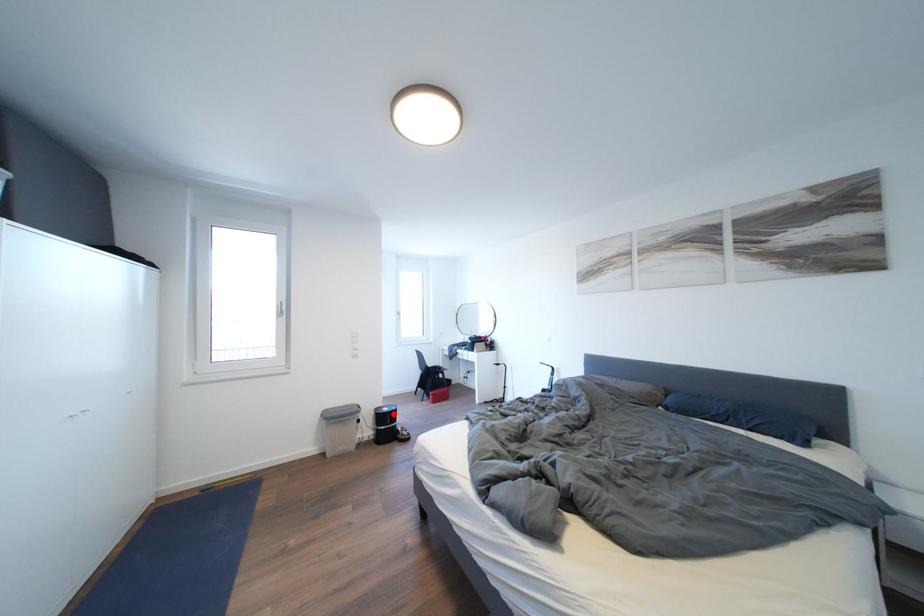
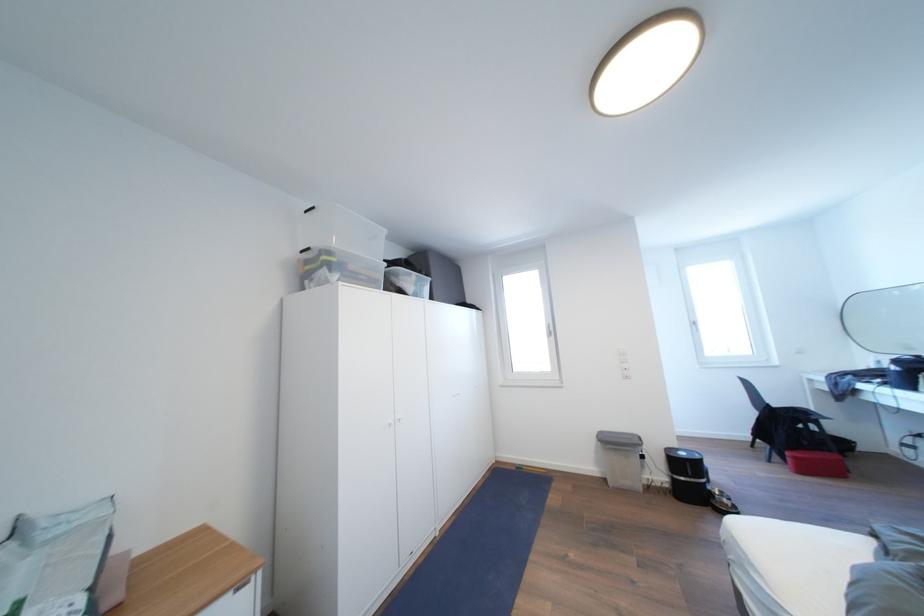
Question: I am providing you with two images of the same scene from different viewpoints. A red point is marked on the first image. At the location where the point appears in image 1, is it still visible in image 2?

Choices:
 (A) Yes
 (B) No

Answer: (A)